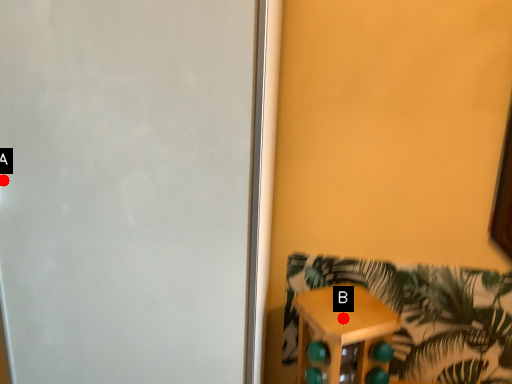
Question: Two points are circled on the image, labeled by A and B beside each circle. Which point is further to the camera?

Choices:
 (A) A is further
 (B) B is further

Answer: (B)